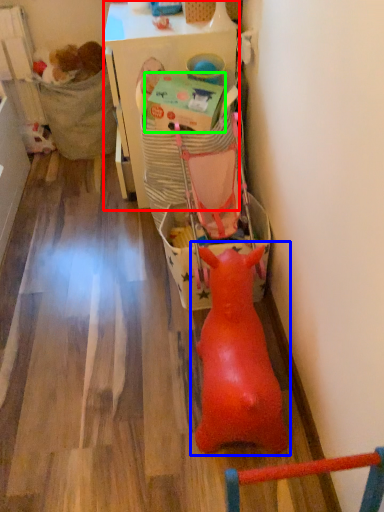
Question: Which is nearer to the table (highlighted by a red box)? toy (highlighted by a blue box) or box (highlighted by a green box).

Choices:
 (A) toy
 (B) box

Answer: (B)